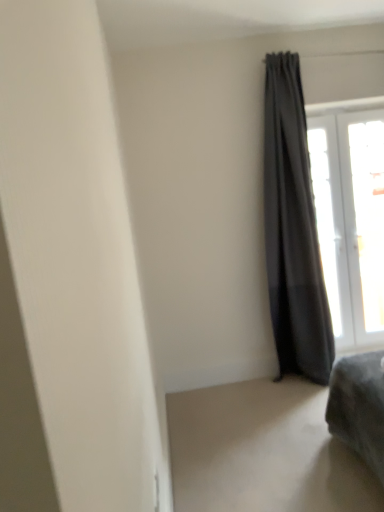
Where is `free space in front of dark gray fabric curtain at right`? Image resolution: width=384 pixels, height=512 pixels. free space in front of dark gray fabric curtain at right is located at coordinates (303, 404).